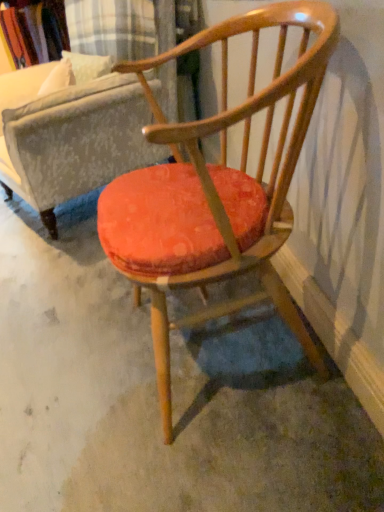
What do you see at coordinates (72, 145) in the screenshot? The image size is (384, 512). I see `velvet orange cushion at center` at bounding box center [72, 145].

Image resolution: width=384 pixels, height=512 pixels. What do you see at coordinates (156, 397) in the screenshot?
I see `orange fabric cushion at center` at bounding box center [156, 397].

Where is `velvet orange cushion at center`? The width and height of the screenshot is (384, 512). velvet orange cushion at center is located at coordinates (72, 145).

Does orange fabric cushion at center have a greater width compared to velvet orange cushion at center?

Yes.

From the image's perspective, is orange fabric cushion at center over velvet orange cushion at center?

No, from the image's perspective, orange fabric cushion at center is not above velvet orange cushion at center.

Which is correct: orange fabric cushion at center is inside velvet orange cushion at center, or outside of it?

The correct answer is: outside.

What's the angular difference between orange fabric cushion at center and velvet orange cushion at center's facing directions?

The angle between the facing direction of orange fabric cushion at center and the facing direction of velvet orange cushion at center is 25.8 degrees.

Between point (289, 209) and point (20, 395), which one is positioned behind?

The point (20, 395) is farther from the camera.

Would you say wooden armchair at center is to the left or to the right of orange fabric cushion at center in the picture?

wooden armchair at center is to the right of orange fabric cushion at center.

From the image's perspective, is wooden armchair at center positioned above or below orange fabric cushion at center?

wooden armchair at center is situated higher than orange fabric cushion at center in the image.

Is wooden armchair at center looking in the opposite direction of orange fabric cushion at center?

wooden armchair at center is not turned away from orange fabric cushion at center.

Is orange fabric cushion at center not near wooden armchair at center?

No, there isn't a large distance between orange fabric cushion at center and wooden armchair at center.

The width and height of the screenshot is (384, 512). I want to click on chair on the right of orange fabric cushion at center, so click(216, 188).

Is orange fabric cushion at center inside or outside of wooden armchair at center?

orange fabric cushion at center cannot be found inside wooden armchair at center.

Is orange fabric cushion at center bigger than wooden armchair at center?

Incorrect, orange fabric cushion at center is not larger than wooden armchair at center.

In the scene shown: From the image's perspective, is velvet orange cushion at center on top of orange fabric cushion at center?

Yes, from the image's perspective, velvet orange cushion at center is over orange fabric cushion at center.

From the picture: What's the angular difference between velvet orange cushion at center and orange fabric cushion at center's facing directions?

The facing directions of velvet orange cushion at center and orange fabric cushion at center are 25.8 degrees apart.

Would you say velvet orange cushion at center is outside orange fabric cushion at center?

Indeed, velvet orange cushion at center is completely outside orange fabric cushion at center.

Is velvet orange cushion at center facing towards orange fabric cushion at center?

No, velvet orange cushion at center is not aimed at orange fabric cushion at center.

Considering the sizes of wooden armchair at center and velvet orange cushion at center in the image, is wooden armchair at center taller or shorter than velvet orange cushion at center?

Clearly, wooden armchair at center is shorter compared to velvet orange cushion at center.

Considering the relative sizes of wooden armchair at center and velvet orange cushion at center in the image provided, is wooden armchair at center bigger than velvet orange cushion at center?

No.

Is wooden armchair at center positioned with its back to velvet orange cushion at center?

No, wooden armchair at center's orientation is not away from velvet orange cushion at center.

What are the coordinates of `swivel chair that appears behind the wooden armchair at center` in the screenshot? It's located at (72, 145).

Consider the image. Does velvet orange cushion at center have a lesser width compared to wooden armchair at center?

No.

Would you consider velvet orange cushion at center to be distant from wooden armchair at center?

No, there isn't a large distance between velvet orange cushion at center and wooden armchair at center.

Choose the correct answer: Is velvet orange cushion at center inside wooden armchair at center or outside it?

The correct answer is: outside.

Where is `concrete below the velvet orange cushion at center (from a real-world perspective)`? The image size is (384, 512). concrete below the velvet orange cushion at center (from a real-world perspective) is located at coordinates (156, 397).

At what (x,y) coordinates should I click in order to perform the action: click on chair in front of the orange fabric cushion at center. Please return your answer as a coordinate pair (x, y). Looking at the image, I should click on (216, 188).

Looking at this image, when comparing their distances from velvet orange cushion at center, does orange fabric cushion at center or wooden armchair at center seem further?

Among the two, wooden armchair at center is located further to velvet orange cushion at center.

Based on their spatial positions, is orange fabric cushion at center or velvet orange cushion at center closer to wooden armchair at center?

orange fabric cushion at center is positioned closer to the anchor wooden armchair at center.

From the image, which object appears to be nearer to wooden armchair at center, velvet orange cushion at center or orange fabric cushion at center?

Based on the image, orange fabric cushion at center appears to be nearer to wooden armchair at center.

Considering their positions, is wooden armchair at center positioned closer to orange fabric cushion at center than velvet orange cushion at center?

wooden armchair at center is positioned closer to the anchor orange fabric cushion at center.

Estimate the real-world distances between objects in this image. Which object is closer to orange fabric cushion at center, velvet orange cushion at center or wooden armchair at center?

Among the two, wooden armchair at center is located nearer to orange fabric cushion at center.

Considering their positions, is wooden armchair at center positioned further to velvet orange cushion at center than orange fabric cushion at center?

wooden armchair at center is positioned further to the anchor velvet orange cushion at center.

At what (x,y) coordinates should I click in order to perform the action: click on chair that lies between velvet orange cushion at center and orange fabric cushion at center from top to bottom. Please return your answer as a coordinate pair (x, y). The image size is (384, 512). Looking at the image, I should click on (216, 188).